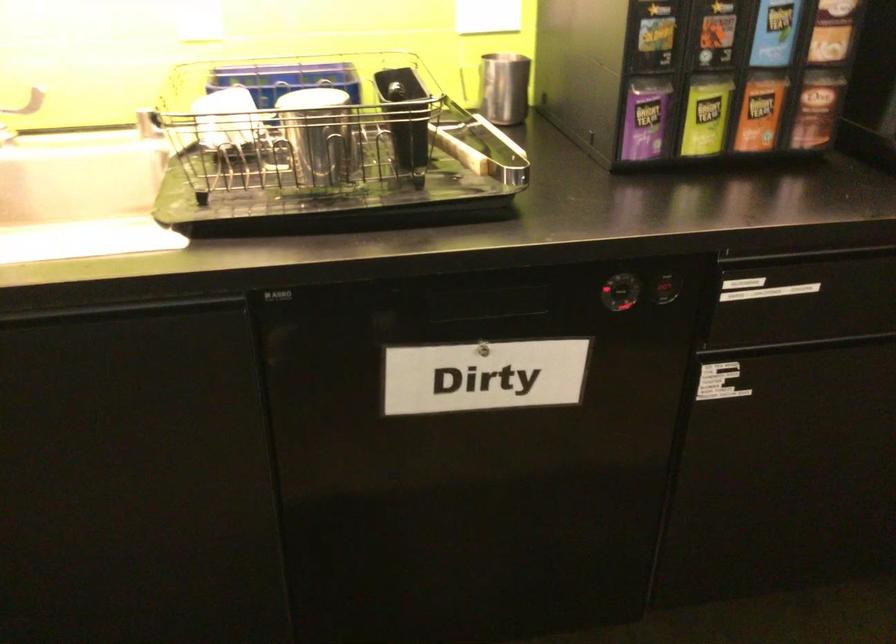
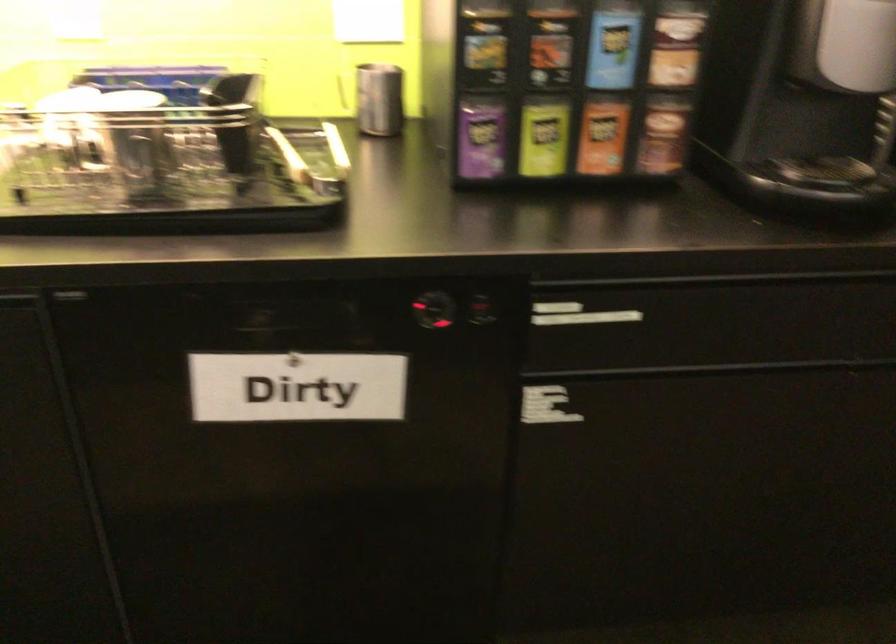
Where in the second image is the point corresponding to [618,292] from the first image?

(433, 310)